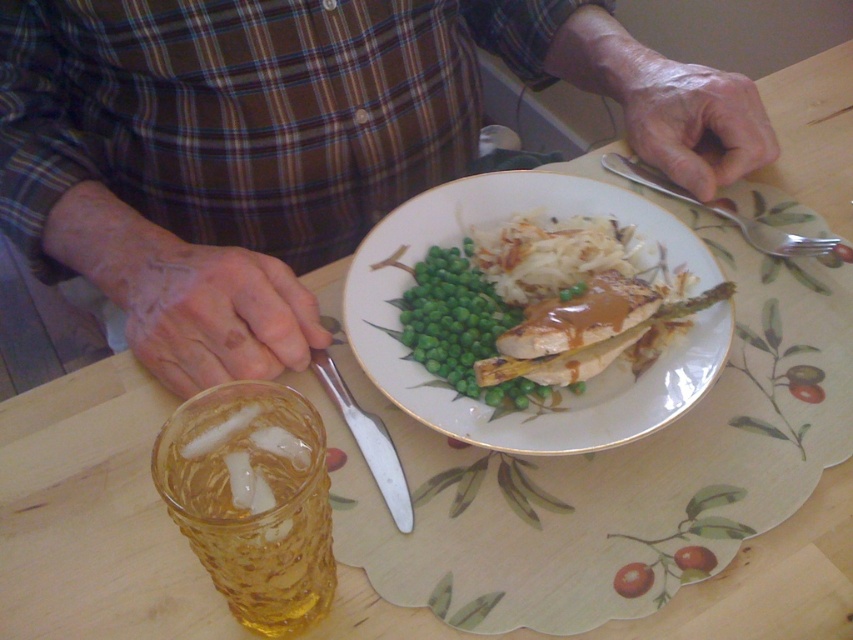
Question: Can you confirm if white glossy plate at center is positioned above translucent amber glass at lower left?

Choices:
 (A) no
 (B) yes

Answer: (B)

Question: Can you confirm if silver metallic knife at center is wider than silver spoon at upper right?

Choices:
 (A) yes
 (B) no

Answer: (B)

Question: Is translucent amber glass at lower left to the left of silver spoon at upper right from the viewer's perspective?

Choices:
 (A) yes
 (B) no

Answer: (A)

Question: Considering the real-world distances, which object is closest to the silver spoon at upper right?

Choices:
 (A) white glossy plate at center
 (B) silver metallic knife at center
 (C) brown plaid shirt at center
 (D) translucent amber glass at lower left

Answer: (A)

Question: Which point is farther to the camera?

Choices:
 (A) (669, 180)
 (B) (556, 211)

Answer: (A)

Question: Estimate the real-world distances between objects in this image. Which object is farther from the silver metallic knife at center?

Choices:
 (A) translucent amber glass at lower left
 (B) brown plaid shirt at center
 (C) silver spoon at upper right
 (D) white glossy plate at center

Answer: (C)